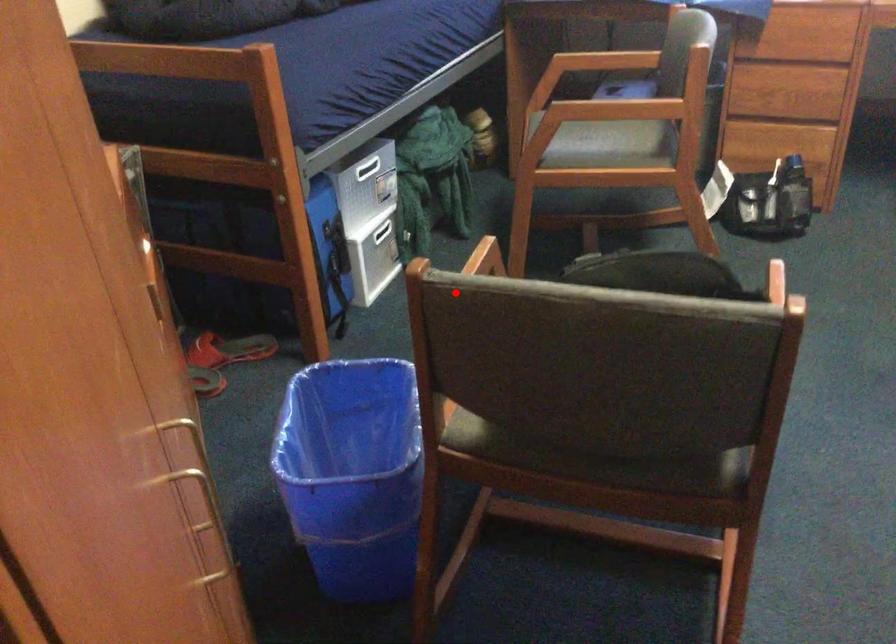
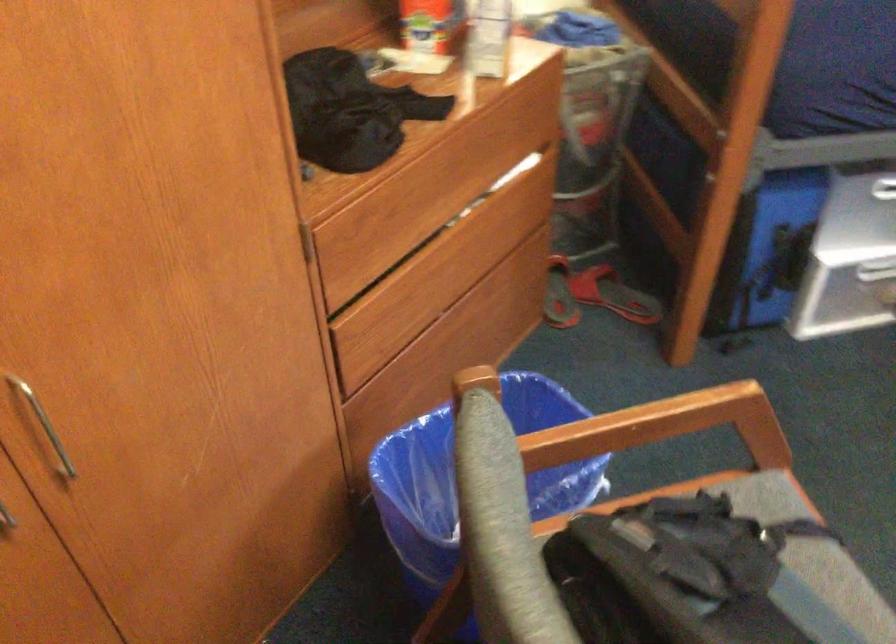
Question: A red point is marked in image1. In image2, is the corresponding 3D point closer to the camera or farther? Reply with the corresponding letter.

Choices:
 (A) The corresponding 3D point is closer.
 (B) The corresponding 3D point is farther.

Answer: (A)